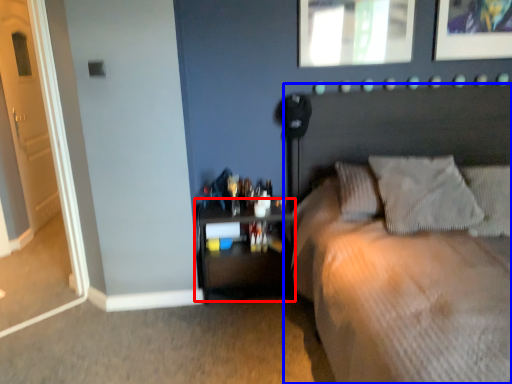
Question: Which of the following is the closest to the observer, nightstand (highlighted by a red box) or bed (highlighted by a blue box)?

Choices:
 (A) nightstand
 (B) bed

Answer: (B)